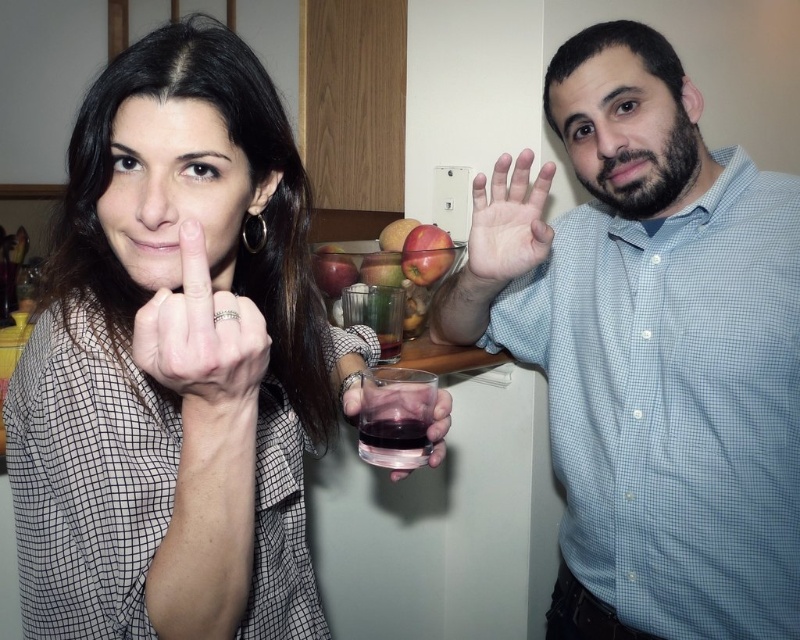
Is matte black shirt at left below glossy apple at center?

Indeed, matte black shirt at left is positioned under glossy apple at center.

The image size is (800, 640). What do you see at coordinates (176, 362) in the screenshot? I see `matte black shirt at left` at bounding box center [176, 362].

Identify the location of matte black shirt at left. (176, 362).

Is point (606, 356) positioned before point (434, 276)?

Yes, point (606, 356) is in front of point (434, 276).

Who is shorter, light blue checkered shirt at right or red matte apple at center?

red matte apple at center is shorter.

Locate an element on the screen. Image resolution: width=800 pixels, height=640 pixels. light blue checkered shirt at right is located at coordinates (650, 349).

You are a GUI agent. You are given a task and a screenshot of the screen. Output one action in this format:
    pyautogui.click(x=<x>, y=<y>)
    Task: Click on the light blue checkered shirt at right
    
    Given the screenshot: What is the action you would take?
    pyautogui.click(x=650, y=349)

The width and height of the screenshot is (800, 640). I want to click on transparent plastic wine glass at center, so click(x=396, y=417).

Is point (424, 426) positioned before point (437, 269)?

Yes, point (424, 426) is in front of point (437, 269).

The width and height of the screenshot is (800, 640). In order to click on transparent plastic wine glass at center in this screenshot , I will do `click(396, 417)`.